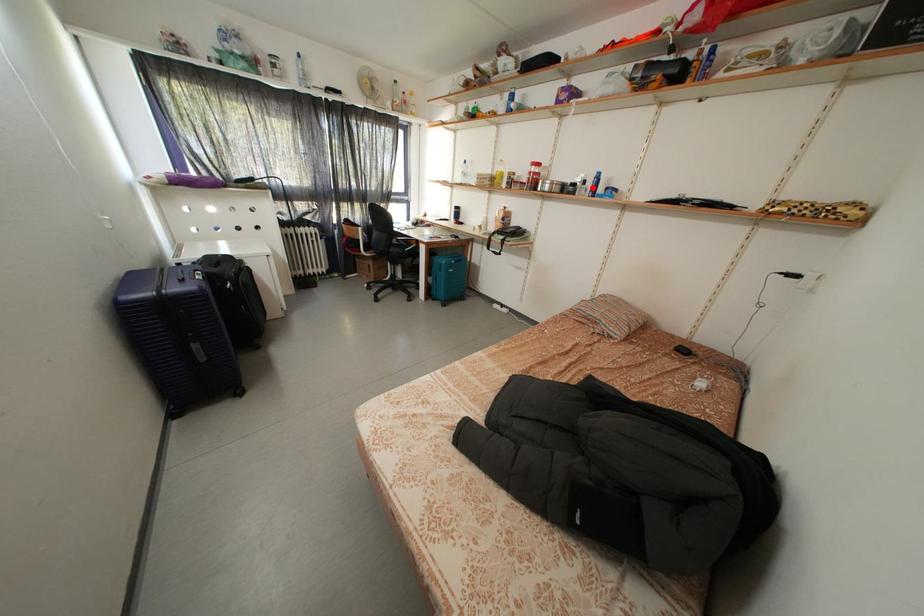
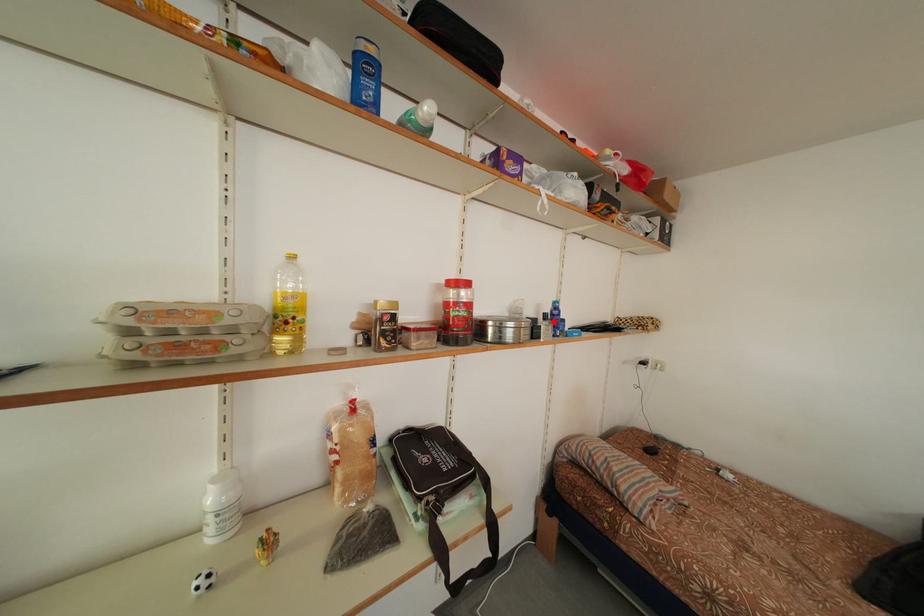
I am providing you with two images of the same scene from different viewpoints. A red point is marked on the first image and another point is marked on the second image. Is the red point in image1 aligned with the point shown in image2?

Yes